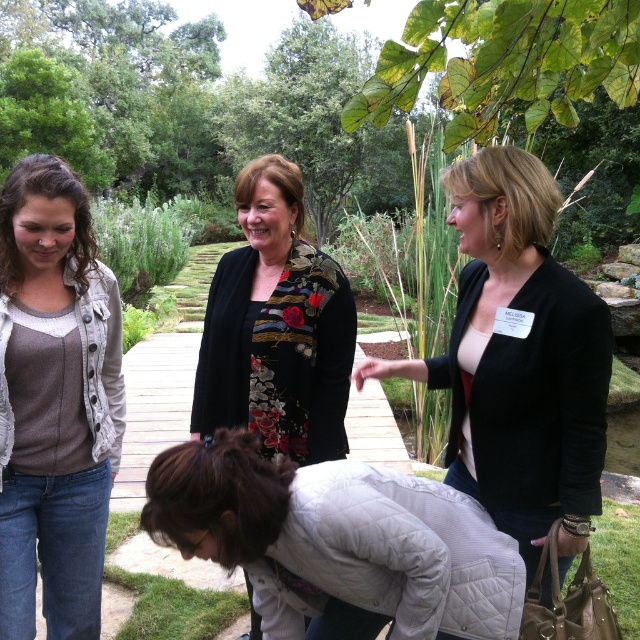
You are standing at the origin point of the coordinate system in the image. The black matte blazer at upper right is located at point (518,360). If you want to walk towards the black matte blazer at upper right, which direction should you move?

To reach the black matte blazer at upper right located at point (518,360) from the origin, you should move northeast since the coordinates are both greater than 0.5, indicating a position to the upper right.